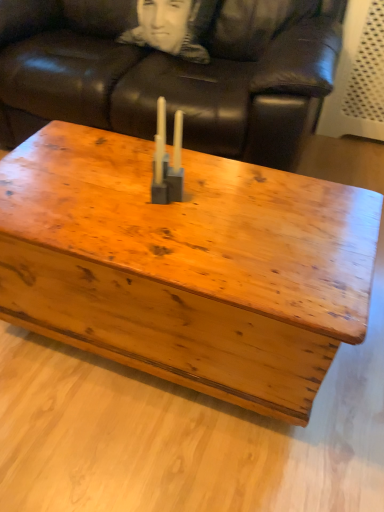
Locate an element on the screen. The image size is (384, 512). vacant space in front of matte gray plastic candle holder at center is located at coordinates (163, 240).